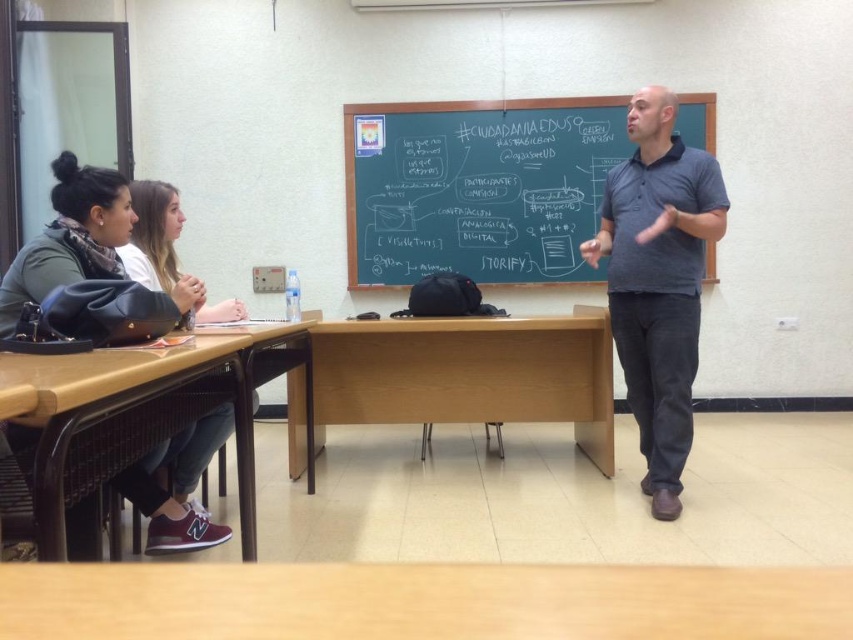
You are a student trying to write a note on the green chalkboard at center. However, you are standing next to the dark blue polo shirt at center. Can you reach the chalkboard without moving your position?

The green chalkboard at center is wider than the dark blue polo shirt at center, so you can reach it without moving since the chalkboard extends beyond the polo shirt.

You are a student sitting at the desk in the classroom. You notice two points marked in the image. Which point is closer to you, point (465, 376) or point (648, 342)?

Point (465, 376) is closer to you because it is further to the viewer than point (648, 342).

You are a student who needs to reach the light brown wood table at center from your current position. Considering the distance between you and the table, can you estimate how many average steps you would need to take to reach it?

The distance between you and the light brown wood table at center is 3.16 meters. An average step is about 0.76 meters, so dividing 3.16 by 0.76 gives approximately 4.16 steps. Therefore, you would need around 4 to 5 average steps to reach the light brown wood table at center.